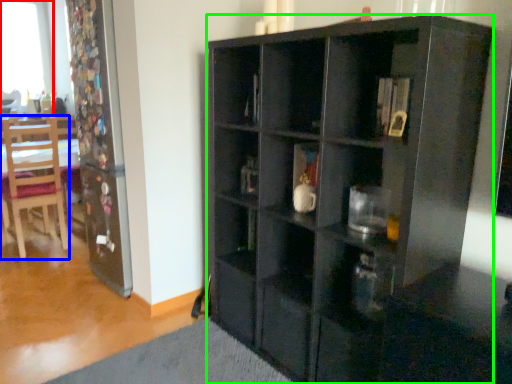
Question: Which object is the closest to the window (highlighted by a red box)? Choose among these: chair (highlighted by a blue box) or cabinetry (highlighted by a green box).

Choices:
 (A) chair
 (B) cabinetry

Answer: (A)